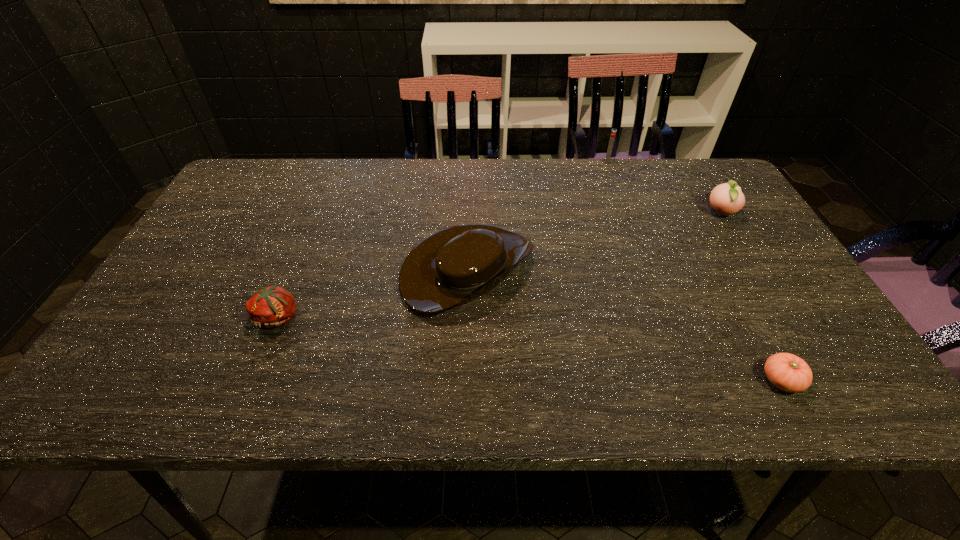
Image resolution: width=960 pixels, height=540 pixels. Identify the location of the farthest object. click(x=613, y=133).

The image size is (960, 540). I want to click on igniter, so click(613, 133).

I want to click on the fourth nearest object, so click(726, 199).

Identify the location of the fourth object from right to left. The image size is (960, 540). click(x=455, y=265).

Locate an element on the screen. Image resolution: width=960 pixels, height=540 pixels. the left tomato is located at coordinates (273, 306).

I want to click on the taller tomato, so click(x=273, y=306).

Locate an element on the screen. the nearest object is located at coordinates (786, 371).

The height and width of the screenshot is (540, 960). Identify the location of the shorter tomato. (786, 371).

I want to click on free space located 0.320m on the front of the third object from left to right, so click(632, 228).

Where is `blank space located on the left of the fourth nearest object`? The image size is (960, 540). blank space located on the left of the fourth nearest object is located at coordinates (652, 213).